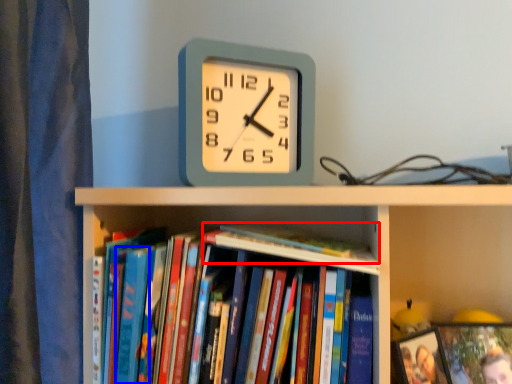
Question: Among these objects, which one is nearest to the camera, book (highlighted by a red box) or paperback book (highlighted by a blue box)?

Choices:
 (A) book
 (B) paperback book

Answer: (A)